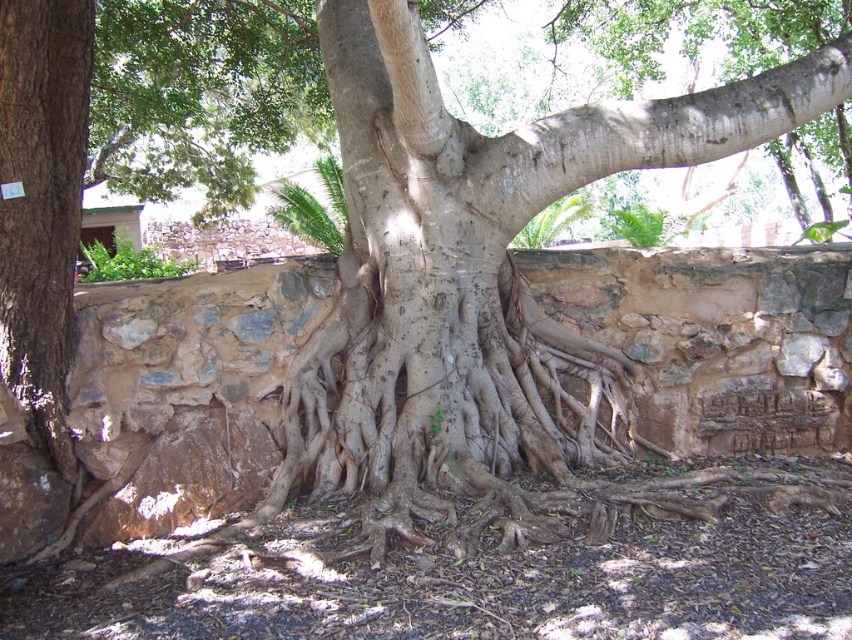
Does point (311, 435) come in front of point (72, 339)?

No, it is not.

Does point (354, 380) lie behind point (39, 125)?

Yes, it is behind point (39, 125).

Locate an element on the screen. Image resolution: width=852 pixels, height=640 pixels. smooth gray bark at center is located at coordinates (476, 282).